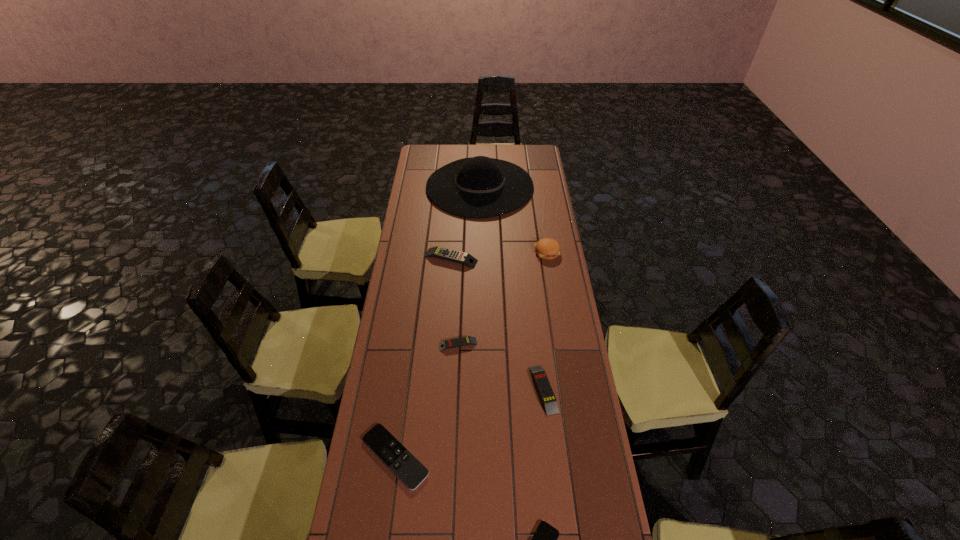
Where is `the second nearest remote control`? the second nearest remote control is located at coordinates (400, 461).

In order to click on vacant area located 0.080m on the front-facing side of the farthest object in this screenshot , I will do `click(548, 186)`.

This screenshot has width=960, height=540. Identify the location of free space located on the left of the second tallest object. (496, 252).

The image size is (960, 540). Find the location of `vacant space located on the back of the farthest remote control`. vacant space located on the back of the farthest remote control is located at coordinates (453, 221).

This screenshot has width=960, height=540. Find the location of `blank space located on the back of the third farthest remote control`. blank space located on the back of the third farthest remote control is located at coordinates (535, 312).

I want to click on free space located 0.160m on the back of the second farthest remote control, so click(460, 305).

At what (x,y) coordinates should I click in order to perform the action: click on free space located on the back of the bigger black remote control. Please return your answer as a coordinate pair (x, y). The height and width of the screenshot is (540, 960). Looking at the image, I should click on (408, 360).

Locate an element on the screen. This screenshot has width=960, height=540. object that is at the far edge is located at coordinates (478, 187).

This screenshot has width=960, height=540. What are the coordinates of `sombrero that is at the left edge` in the screenshot? It's located at (478, 187).

Locate an element on the screen. sombrero at the right edge is located at coordinates (478, 187).